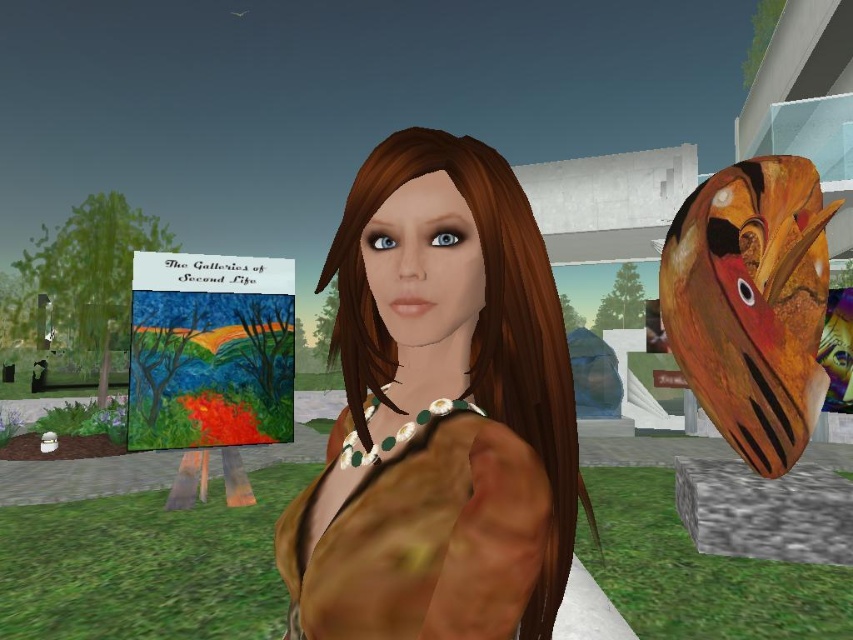
Which is more to the right, brown matte jacket at center or brown matte dress at center?

brown matte jacket at center

Is brown matte jacket at center thinner than brown matte dress at center?

In fact, brown matte jacket at center might be wider than brown matte dress at center.

What are the coordinates of `brown matte jacket at center` in the screenshot? It's located at (439, 412).